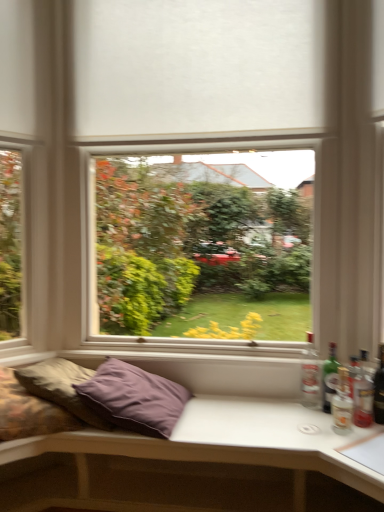
Question: In the image, is clear glass bottle at right, which is the first bottle from back to front, on the left side or the right side of purple fabric studio couch at lower center?

Choices:
 (A) left
 (B) right

Answer: (B)

Question: In terms of width, does clear glass bottle at right, the 3th bottle viewed from the front, look wider or thinner when compared to purple fabric studio couch at lower center?

Choices:
 (A) wide
 (B) thin

Answer: (B)

Question: Based on their relative distances, which object is nearer to the translucent glass beer bottle at right?

Choices:
 (A) purple fabric studio couch at lower center
 (B) clear glass bottle at right, the 3th bottle viewed from the front
 (C) purple fabric pillow at lower left, the 2th pillow from the right
 (D) translucent glass bottle at right, which is the third bottle from back to front
 (E) green glass bottle at right, the second bottle in the back-to-front sequence

Answer: (D)

Question: Which object is positioned farthest from the purple fabric pillow at lower left, which is the 1th pillow from left to right?

Choices:
 (A) purple fabric pillow at lower left, placed as the second pillow when sorted from left to right
 (B) translucent glass beer bottle at right
 (C) green glass bottle at right, the second bottle in the back-to-front sequence
 (D) translucent glass bottle at right, which ranks as the first bottle in front-to-back order
 (E) purple fabric studio couch at lower center

Answer: (B)